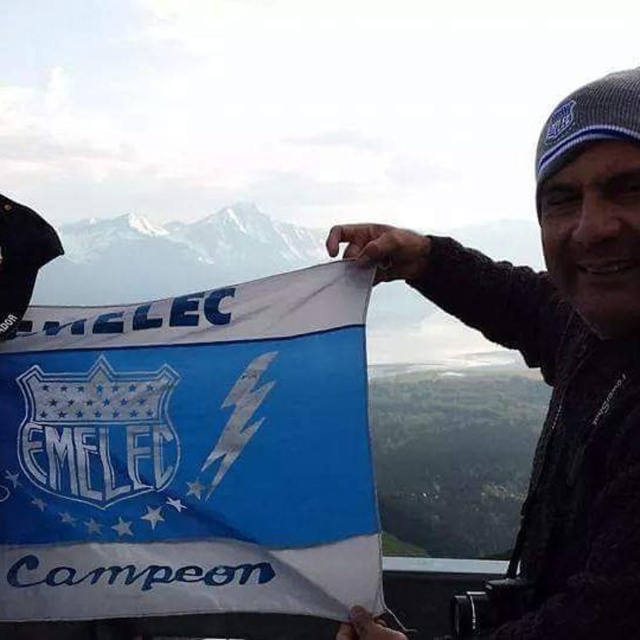
Question: Which of the following is the farthest from the observer?

Choices:
 (A) (166, 304)
 (B) (477, 269)

Answer: (B)

Question: Does blue fabric flag at center appear on the right side of knitted wool beanie at upper right?

Choices:
 (A) yes
 (B) no

Answer: (B)

Question: Which of the following is the farthest from the observer?

Choices:
 (A) blue fabric flag at center
 (B) knitted wool beanie at upper right

Answer: (A)

Question: Which of the following is the closest to the observer?

Choices:
 (A) (605, 468)
 (B) (122, 378)

Answer: (A)

Question: Where is blue fabric flag at center located in relation to knitted wool beanie at upper right in the image?

Choices:
 (A) above
 (B) below

Answer: (B)

Question: Does blue fabric flag at center appear on the right side of knitted wool beanie at upper right?

Choices:
 (A) yes
 (B) no

Answer: (B)